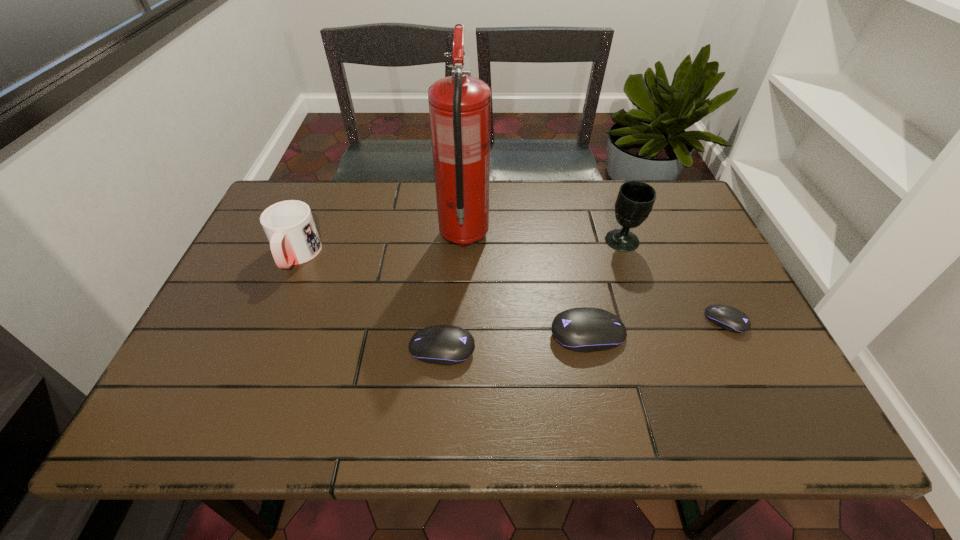
Locate an element on the screen. vacant place for an extra computer mouse on the left is located at coordinates (288, 364).